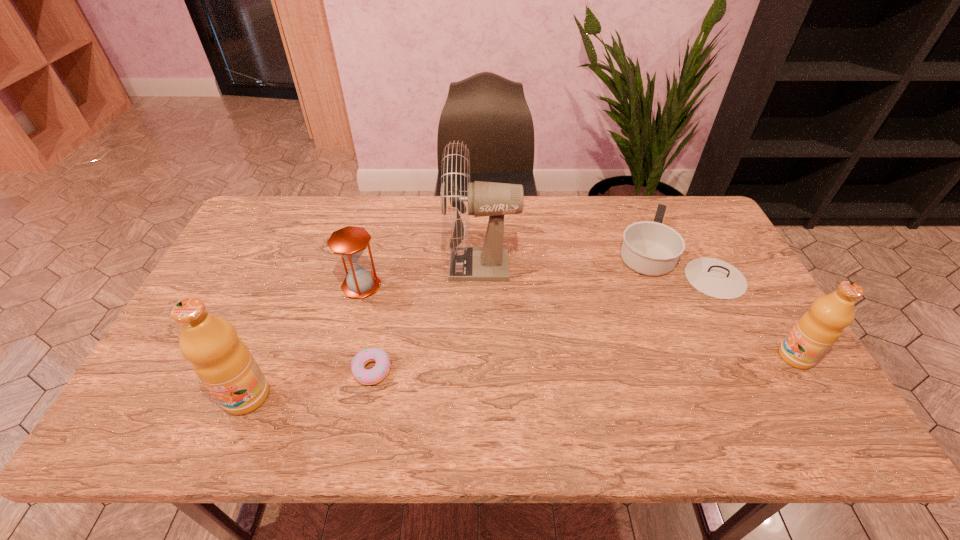
You are a GUI agent. You are given a task and a screenshot of the screen. Output one action in this format:
    pyautogui.click(x=<x>, y=<y>)
    Task: Click on the taller fruit juice
    The width and height of the screenshot is (960, 540).
    Given the screenshot: What is the action you would take?
    pyautogui.click(x=222, y=361)

At what (x,y) coordinates should I click in order to perform the action: click on the leftmost object. Please return your answer as a coordinate pair (x, y). Looking at the image, I should click on (222, 361).

Identify the location of the third tallest object. (816, 331).

In order to click on the shorter fruit juice in this screenshot , I will do `click(816, 331)`.

Where is `saucepan`? saucepan is located at coordinates (651, 248).

Find the location of a particular element. This screenshot has height=540, width=960. the third shortest object is located at coordinates (349, 242).

This screenshot has width=960, height=540. Find the location of `the tallest object`. the tallest object is located at coordinates (489, 262).

The image size is (960, 540). Identify the location of fan. (489, 262).

The height and width of the screenshot is (540, 960). I want to click on doughnut, so click(x=381, y=369).

The image size is (960, 540). Find the location of `vacant point located on the front label of the shorter fruit juice`. vacant point located on the front label of the shorter fruit juice is located at coordinates (640, 356).